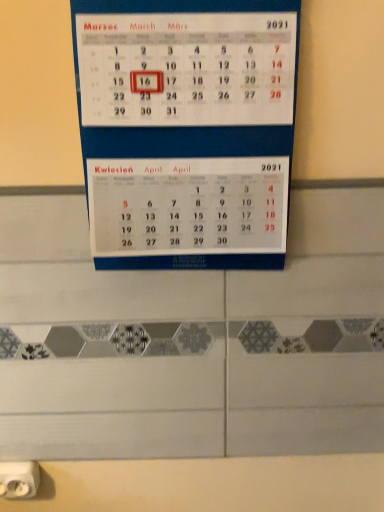
Where is `white paper calendar at center`? This screenshot has height=512, width=384. white paper calendar at center is located at coordinates (187, 130).

The image size is (384, 512). What do you see at coordinates (187, 130) in the screenshot?
I see `white paper calendar at center` at bounding box center [187, 130].

Image resolution: width=384 pixels, height=512 pixels. Find the location of `white plastic power plugs and sockets at lower left`. white plastic power plugs and sockets at lower left is located at coordinates (19, 479).

What is the approximate width of white plastic power plugs and sockets at lower left?

white plastic power plugs and sockets at lower left is 1.30 inches wide.

What do you see at coordinates (19, 479) in the screenshot? This screenshot has width=384, height=512. I see `white plastic power plugs and sockets at lower left` at bounding box center [19, 479].

You are a GUI agent. You are given a task and a screenshot of the screen. Output one action in this format:
    pyautogui.click(x=<x>, y=<y>)
    Task: Click on the white paper calendar at center
    
    Given the screenshot: What is the action you would take?
    pyautogui.click(x=187, y=130)

Considering the positions of objects white paper calendar at center and white plastic power plugs and sockets at lower left in the image provided, who is more to the right, white paper calendar at center or white plastic power plugs and sockets at lower left?

From the viewer's perspective, white paper calendar at center appears more on the right side.

In the scene shown: Which is in front, white paper calendar at center or white plastic power plugs and sockets at lower left?

white paper calendar at center is in front.

Does point (95, 182) come in front of point (6, 474)?

Yes, point (95, 182) is closer to viewer.

From the image's perspective, is white paper calendar at center on top of white plastic power plugs and sockets at lower left?

Correct, white paper calendar at center appears higher than white plastic power plugs and sockets at lower left in the image.

From a real-world perspective, which object stands above the other?

white paper calendar at center is physically above.

Considering the relative sizes of white paper calendar at center and white plastic power plugs and sockets at lower left in the image provided, is white paper calendar at center thinner than white plastic power plugs and sockets at lower left?

No.

Which of these two, white paper calendar at center or white plastic power plugs and sockets at lower left, stands shorter?

white plastic power plugs and sockets at lower left.

Considering the sizes of objects white paper calendar at center and white plastic power plugs and sockets at lower left in the image provided, who is bigger, white paper calendar at center or white plastic power plugs and sockets at lower left?

white paper calendar at center is bigger.

Which is correct: white paper calendar at center is inside white plastic power plugs and sockets at lower left, or outside of it?

white paper calendar at center is outside white plastic power plugs and sockets at lower left.

Does white paper calendar at center touch white plastic power plugs and sockets at lower left?

white paper calendar at center and white plastic power plugs and sockets at lower left are clearly separated.

Is white paper calendar at center facing towards white plastic power plugs and sockets at lower left?

No, white paper calendar at center is not aimed at white plastic power plugs and sockets at lower left.

What's the angular difference between white paper calendar at center and white plastic power plugs and sockets at lower left's facing directions?

1.48 degrees separate the facing orientations of white paper calendar at center and white plastic power plugs and sockets at lower left.

Where is `bulletin board located on the right of white plastic power plugs and sockets at lower left`? bulletin board located on the right of white plastic power plugs and sockets at lower left is located at coordinates 187,130.

Considering the relative positions of white plastic power plugs and sockets at lower left and white paper calendar at center in the image provided, is white plastic power plugs and sockets at lower left to the left of white paper calendar at center from the viewer's perspective?

Yes.

Between white plastic power plugs and sockets at lower left and white paper calendar at center, which one is positioned in front?

white paper calendar at center is closer to the camera.

Does point (37, 469) come closer to viewer compared to point (100, 178)?

No, it is not.

From the image's perspective, would you say white plastic power plugs and sockets at lower left is positioned over white paper calendar at center?

No, from the image's perspective, white plastic power plugs and sockets at lower left is not above white paper calendar at center.

From a real-world perspective, is white plastic power plugs and sockets at lower left positioned above or below white paper calendar at center?

In terms of real-world spatial position, white plastic power plugs and sockets at lower left is below white paper calendar at center.

Between white plastic power plugs and sockets at lower left and white paper calendar at center, which one has smaller width?

Thinner between the two is white plastic power plugs and sockets at lower left.

Considering the sizes of objects white plastic power plugs and sockets at lower left and white paper calendar at center in the image provided, who is shorter, white plastic power plugs and sockets at lower left or white paper calendar at center?

white plastic power plugs and sockets at lower left is shorter.

Looking at the image, does white plastic power plugs and sockets at lower left seem bigger or smaller compared to white paper calendar at center?

In the image, white plastic power plugs and sockets at lower left appears to be smaller than white paper calendar at center.

Is white plastic power plugs and sockets at lower left situated inside white paper calendar at center or outside?

white plastic power plugs and sockets at lower left is outside white paper calendar at center.

Does white plastic power plugs and sockets at lower left touch white paper calendar at center?

No, white plastic power plugs and sockets at lower left is not beside white paper calendar at center.

Is white plastic power plugs and sockets at lower left facing away from white paper calendar at center?

No, white plastic power plugs and sockets at lower left's orientation is not away from white paper calendar at center.

Consider the image. How far apart are white plastic power plugs and sockets at lower left and white paper calendar at center?

white plastic power plugs and sockets at lower left and white paper calendar at center are 68.94 centimeters apart from each other.

The image size is (384, 512). I want to click on bulletin board on the right of white plastic power plugs and sockets at lower left, so coord(187,130).

This screenshot has width=384, height=512. In order to click on bulletin board above the white plastic power plugs and sockets at lower left (from the image's perspective) in this screenshot , I will do 187,130.

The height and width of the screenshot is (512, 384). Find the location of `power plugs and sockets on the left of white paper calendar at center`. power plugs and sockets on the left of white paper calendar at center is located at coordinates coord(19,479).